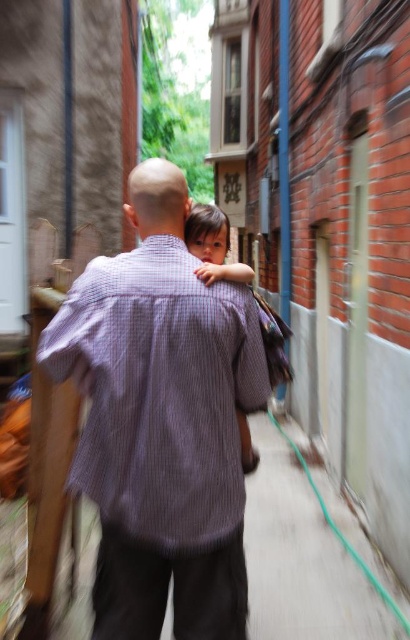
What object is located at the coordinate point (161,420) in the image?

The point (161,420) is located on the purple corduroy shirt at center.

You are a photographer trying to capture a candid shot of the purple corduroy shirt at center and the smooth skin child at center in the alleyway. Since the scene is slightly blurred, you want to adjust your camera settings to focus on both subjects. Given their sizes, which subject should you prioritize focusing on first to ensure clarity?

The purple corduroy shirt at center has a larger size compared to the smooth skin child at center, so focusing on the purple corduroy shirt at center first would ensure the larger subject is clearer before adjusting for the smaller smooth skin child at center.

You are standing at point (202, 275) and want to walk to point (211, 401). Which direction should you move relative to the other point?

You should move forward towards point (211, 401) because it is in front of point (202, 275).